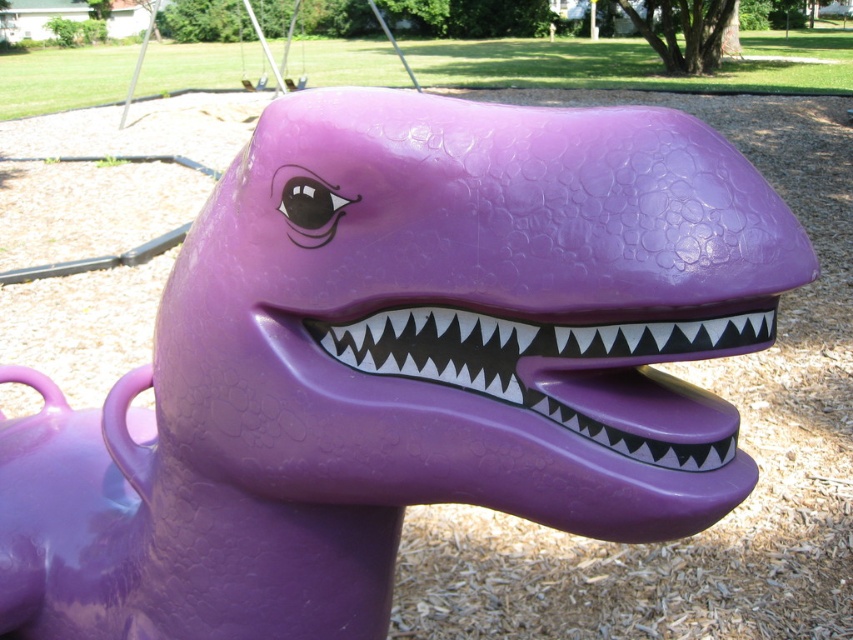
You are standing in front of the purple dinosaur head at the playground. You want to locate the glossy purple mouth at center. Where should you look?

You should look at point (566,371) to find the glossy purple mouth at center.

Looking at this image, you are standing in front of a purple dinosaur playground structure. You notice a point marked at coordinates (566,371). Based on the scene description, what object does this point most likely correspond to?

The point at coordinates (566,371) corresponds to the glossy purple mouth at center, as indicated by the Objects Description.

You are a child at the playground and want to touch the metallic silver swing at upper center. Can you reach it without moving your position, considering the glossy purple mouth at center is blocking your view? Please explain.

The glossy purple mouth at center is in front of the metallic silver swing at upper center, so it is blocking the path. You cannot reach the metallic silver swing at upper center without moving your position because the glossy purple mouth at center is in the way.